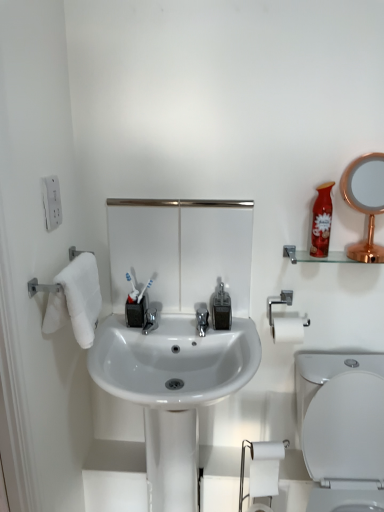
Question: Is white glossy toilet at lower right in front of or behind white glossy sink at center in the image?

Choices:
 (A) front
 (B) behind

Answer: (A)

Question: Is white glossy toilet at lower right to the left or to the right of white glossy sink at center in the image?

Choices:
 (A) left
 (B) right

Answer: (B)

Question: Considering the real-world distances, which object is closest to the white matte toilet paper at lower right?

Choices:
 (A) clear glass shelf at upper right
 (B) white glossy sink at center
 (C) white plastic outlet at upper left
 (D) shiny red plastic mouthwash at upper right
 (E) rose gold metallic mirror at upper right

Answer: (B)

Question: Estimate the real-world distances between objects in this image. Which object is farther from the white matte toilet paper at lower right?

Choices:
 (A) white glossy toilet at lower right
 (B) translucent plastic soap dispenser at center
 (C) white plastic outlet at upper left
 (D) clear glass shelf at upper right
 (E) rose gold metallic mirror at upper right

Answer: (C)